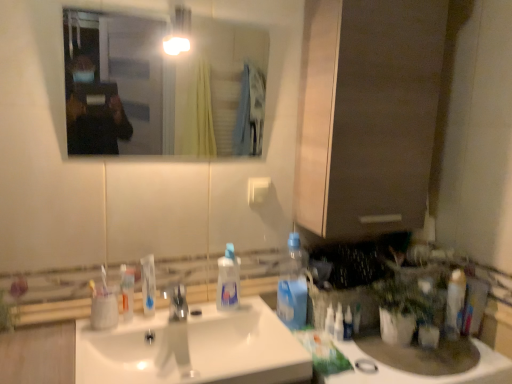
Locate an element on the screen. vacant space to the right of translucent plastic mouthwash at sink is located at coordinates (167, 325).